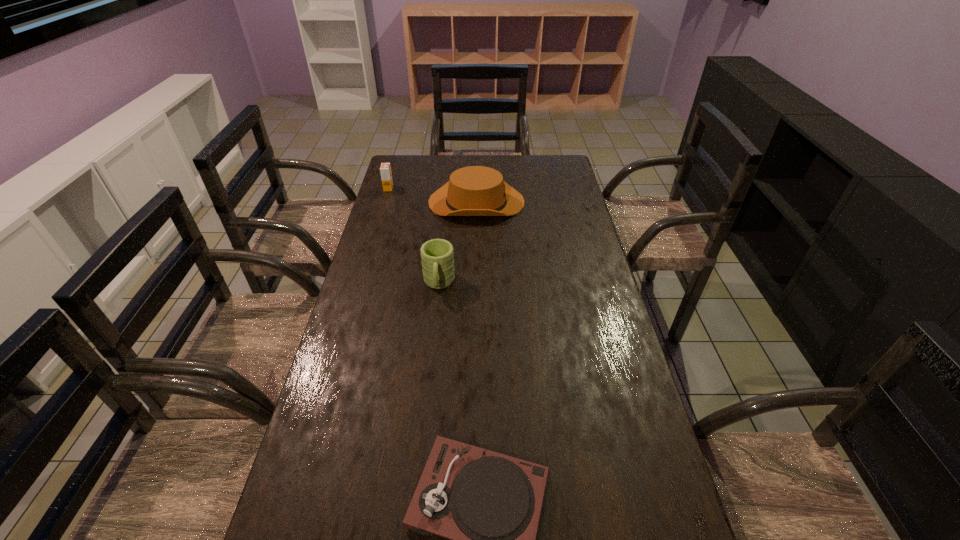
The width and height of the screenshot is (960, 540). Find the location of `vacant space at the far right corner of the desktop`. vacant space at the far right corner of the desktop is located at coordinates (x=538, y=166).

The height and width of the screenshot is (540, 960). I want to click on vacant space that is in between the third farthest object and the cowboy hat, so click(x=458, y=242).

The width and height of the screenshot is (960, 540). I want to click on vacant region between the orange juice and the mug, so click(x=414, y=236).

At what (x,y) coordinates should I click in order to perform the action: click on empty space that is in between the cowboy hat and the mug. Please return your answer as a coordinate pair (x, y). The height and width of the screenshot is (540, 960). Looking at the image, I should click on (458, 242).

Image resolution: width=960 pixels, height=540 pixels. Identify the location of vacant area that lies between the cowboy hat and the third farthest object. (458, 242).

The height and width of the screenshot is (540, 960). Identify the location of the second closest object to the mug. (488, 504).

At what (x,y) coordinates should I click in order to perform the action: click on the third closest object to the orange juice. Please return your answer as a coordinate pair (x, y). This screenshot has height=540, width=960. Looking at the image, I should click on (488, 504).

The width and height of the screenshot is (960, 540). In order to click on vacant region that satisfies the following two spatial constraints: 1. on the front-facing side of the cowboy hat; 2. on the side of the third farthest object with the handle in this screenshot , I will do `click(475, 284)`.